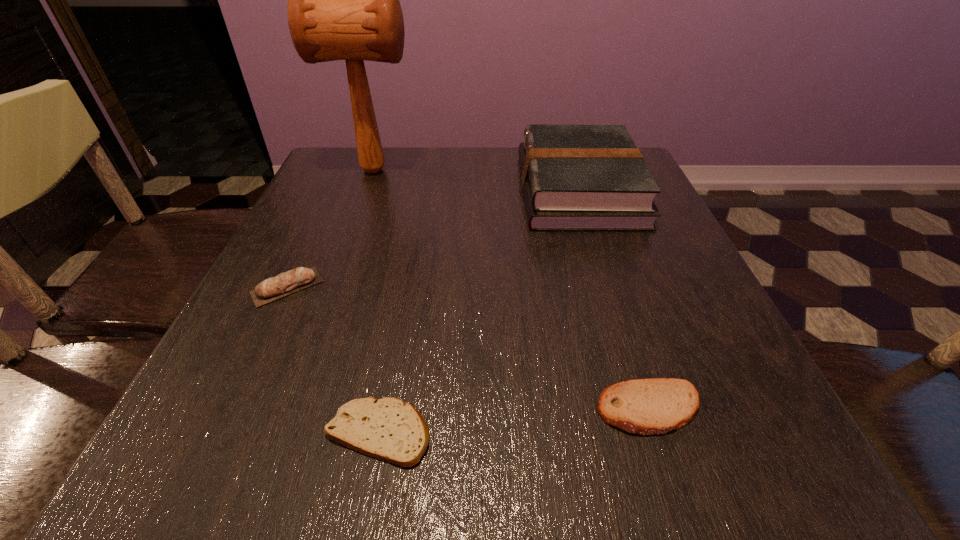
Locate an element on the screen. This screenshot has width=960, height=540. object that stands as the second closest to the leftmost pita bread is located at coordinates pyautogui.click(x=343, y=0).

This screenshot has width=960, height=540. In order to click on pita bread that is the second closest one to the second pita bread from left to right in this screenshot , I will do `click(653, 406)`.

In order to click on the closest pita bread to the mallet in this screenshot , I will do `click(299, 278)`.

Identify the location of vacant position in the image that satisfies the following two spatial constraints: 1. on the spine side of the second tallest object; 2. on the left side of the second tallest pita bread. (649, 409).

Identify the location of vacant area that satisfies the following two spatial constraints: 1. on the strike surface of the shortest object; 2. on the right side of the mallet. (278, 432).

You are a GUI agent. You are given a task and a screenshot of the screen. Output one action in this format:
    pyautogui.click(x=<x>, y=<y>)
    Task: Click on the vacant space that satisfies the following two spatial constraints: 1. on the spine side of the second tallest object; 2. on the right side of the second shortest object
    
    Given the screenshot: What is the action you would take?
    pyautogui.click(x=649, y=409)

Find the location of `vacant area that satisfies the following two spatial constraints: 1. on the spine side of the fourth tallest object; 2. on the left side of the hardback book`. vacant area that satisfies the following two spatial constraints: 1. on the spine side of the fourth tallest object; 2. on the left side of the hardback book is located at coordinates (649, 409).

In order to click on vacant area that satisfies the following two spatial constraints: 1. on the strike surface of the tallest object; 2. on the left side of the second shortest pita bread in this screenshot , I will do `click(287, 409)`.

I want to click on free location that satisfies the following two spatial constraints: 1. on the strike surface of the tallest object; 2. on the back side of the shortest pita bread, so click(x=278, y=432).

You are a GUI agent. You are given a task and a screenshot of the screen. Output one action in this format:
    pyautogui.click(x=<x>, y=<y>)
    Task: Click on the vacant space that satisfies the following two spatial constraints: 1. on the strike surface of the second shortest object; 2. on the left side of the mallet
    
    Given the screenshot: What is the action you would take?
    pyautogui.click(x=287, y=409)